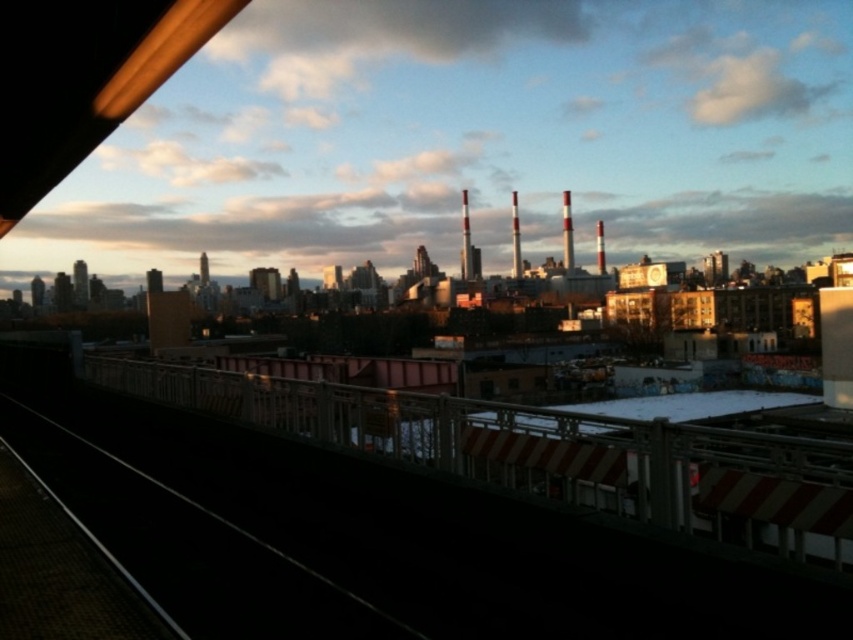
You are standing on the bridge looking at the matte gray sky at upper center and the white metal rail at lower center. Which object is positioned to the right of the other?

The matte gray sky at upper center is positioned to the right of the white metal rail at lower center.

You are a drone operator who needs to fly a drone from the white metal rail at lower center to the matte gray sky at upper center. According to the scene description, what is the approximate distance you need to cover?

The matte gray sky at upper center is 527.69 feet away from the white metal rail at lower center, so the drone needs to cover approximately 527.69 feet to reach the matte gray sky at upper center from the white metal rail at lower center.